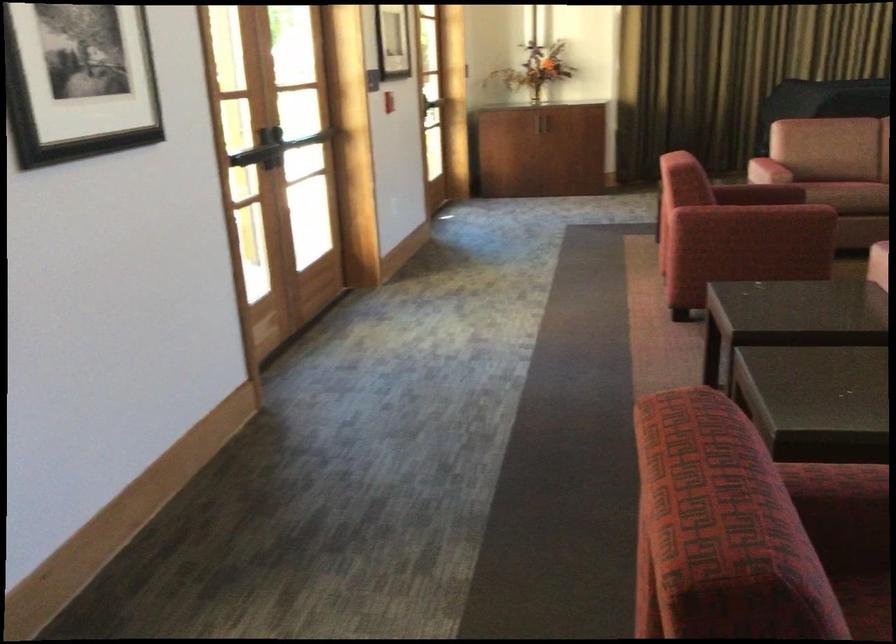
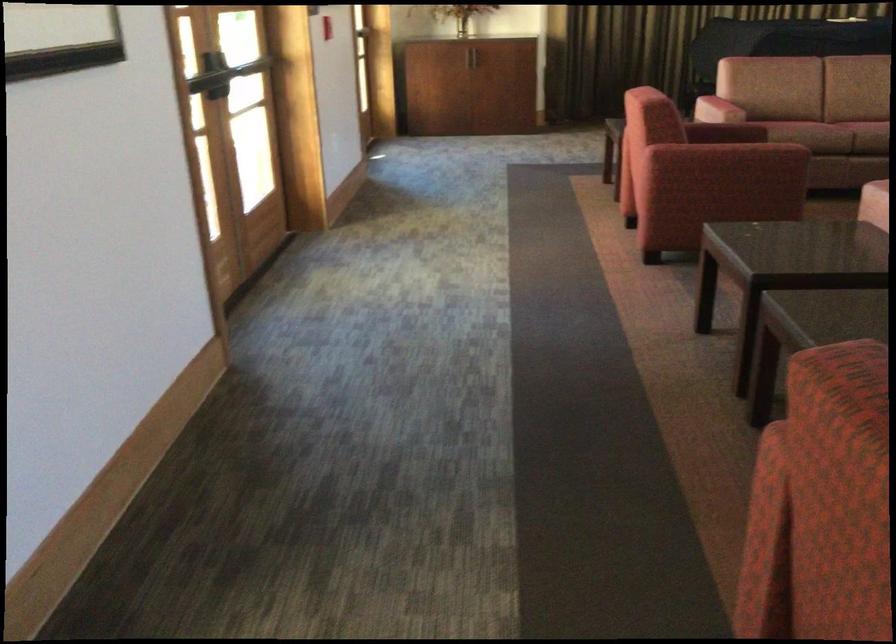
Question: How did the camera likely rotate?

Choices:
 (A) Left
 (B) Right
 (C) Up
 (D) Down

Answer: (B)